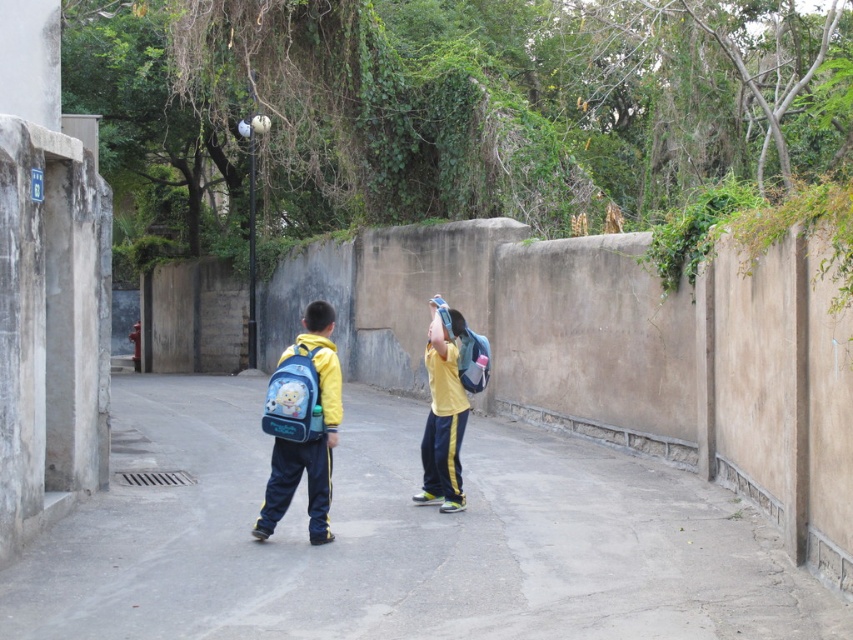
You are a delivery drone that needs to fly through the narrow alleyway. The alleyway is bordered by walls on both sides. You see the matte yellow jacket at center and the blue fabric backpack at center in the middle of the path. Considering their sizes, which object might block your path if you fly directly through the center?

The matte yellow jacket at center has a larger size compared to the blue fabric backpack at center, so the matte yellow jacket at center is more likely to block the path if you fly directly through the center.